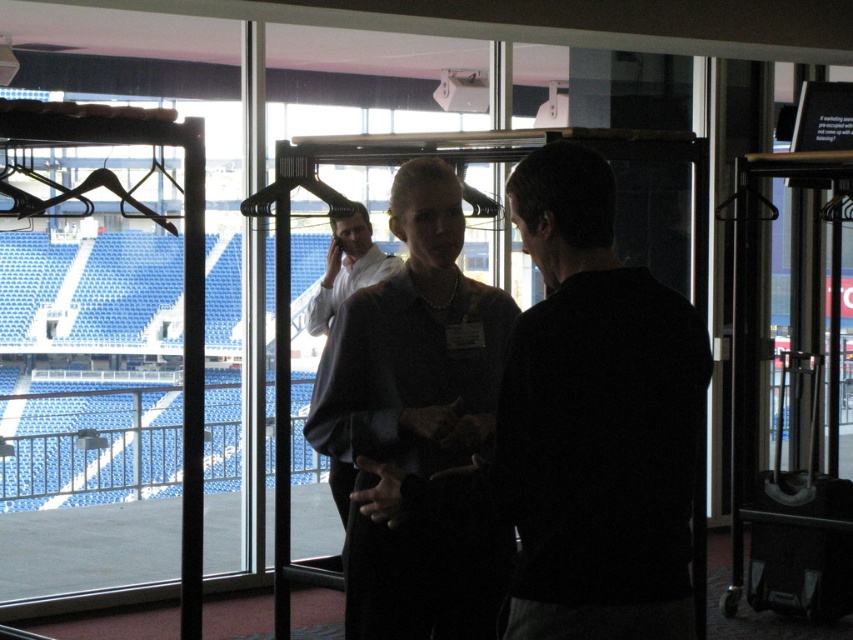
You are a photographer trying to capture a candid shot of the two people at the center of the scene. Since you want to ensure both the dark gray sweater at center and the matte black blouse at center are clearly visible in the frame, which one should you focus on first to ensure proper alignment?

The dark gray sweater at center is positioned on the right side of matte black blouse at center, so you should focus on the matte black blouse at center first to ensure proper alignment.

You are designing a new layout for the seating area in the stadium and need to ensure that the two central statues representing the teams will fit between the matte black blouse at center and the matte white shirt at center. The statues are 1.2 meters wide each. Can both statues fit side by side in the space between them?

The matte black blouse at center is wider than the matte white shirt at center. Since the combined width of both statues is 2.4 meters, but the space between the two objects isn not specified in the description, we cannot determine if they will fit.